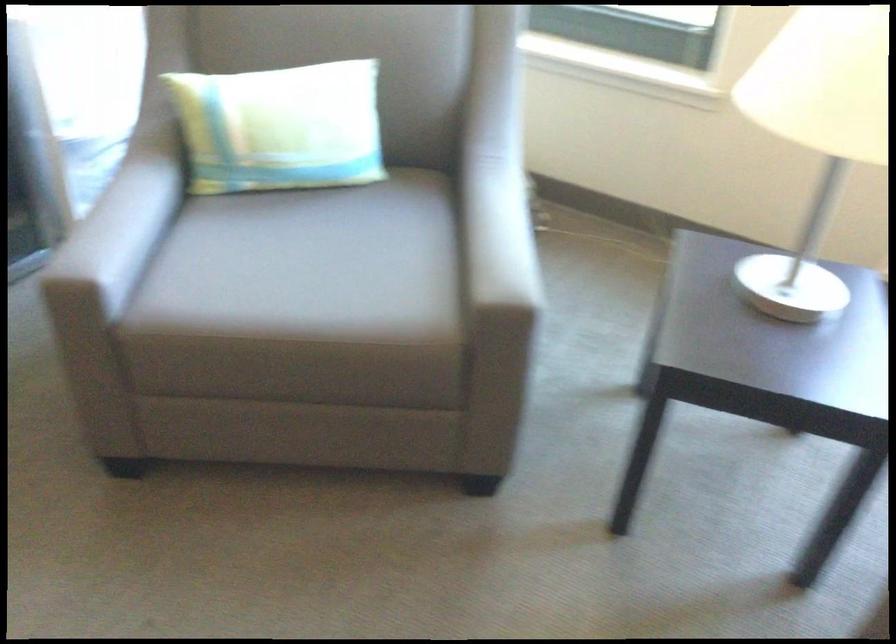
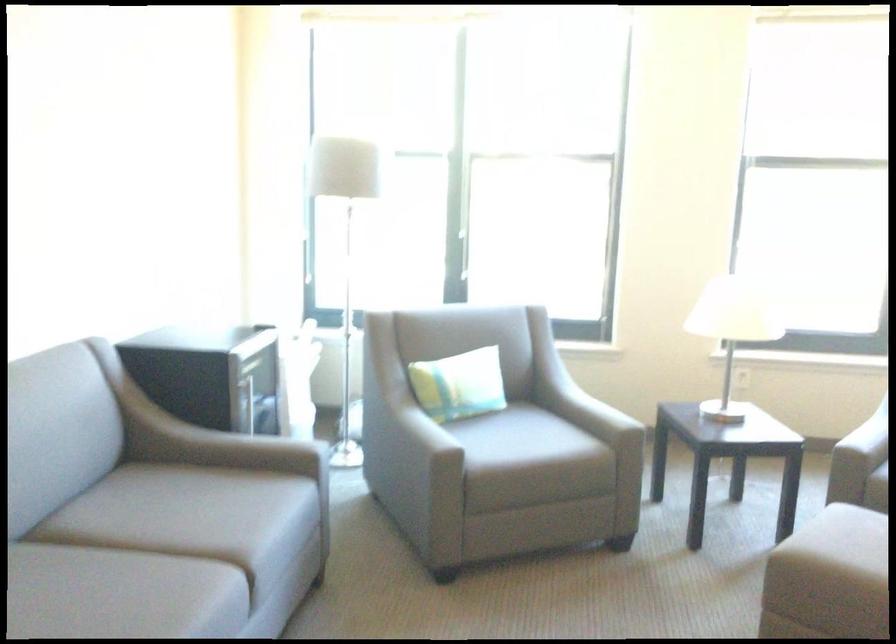
The point at (362, 248) is marked in the first image. Where is the corresponding point in the second image?

(495, 431)